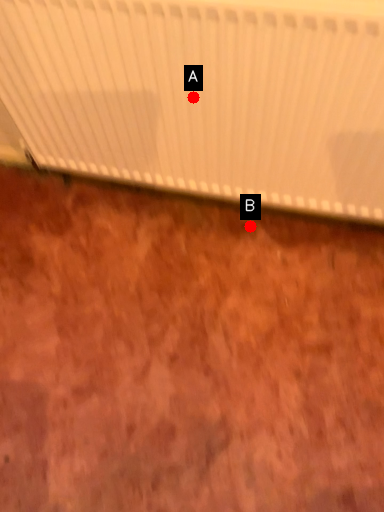
Question: Two points are circled on the image, labeled by A and B beside each circle. Among these points, which one is farthest from the camera?

Choices:
 (A) A is further
 (B) B is further

Answer: (B)